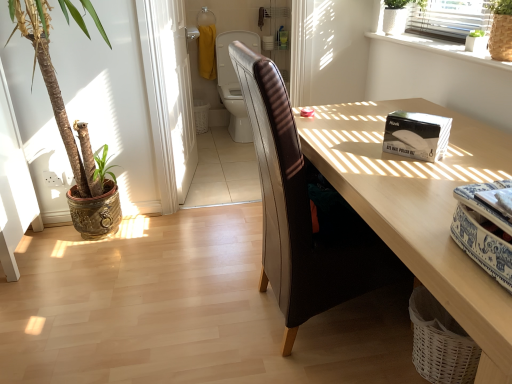
At what (x,y) coordinates should I click in order to perform the action: click on unoccupied space behind white glossy nail polish kit at upper right. Please return your answer as a coordinate pair (x, y). The image size is (512, 384). Looking at the image, I should click on (362, 128).